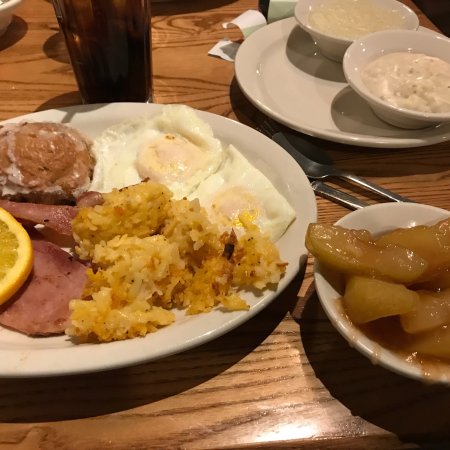
I want to click on table, so click(270, 377).